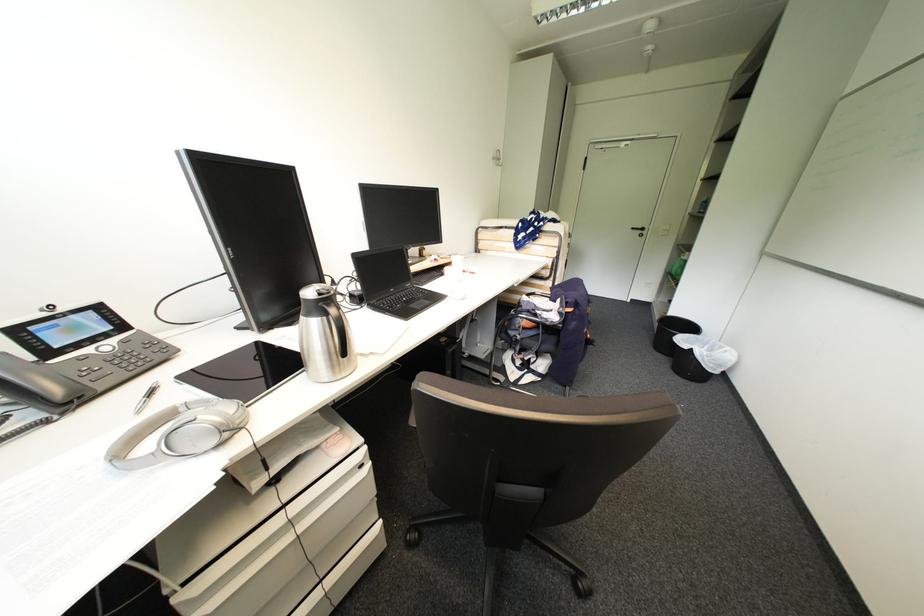
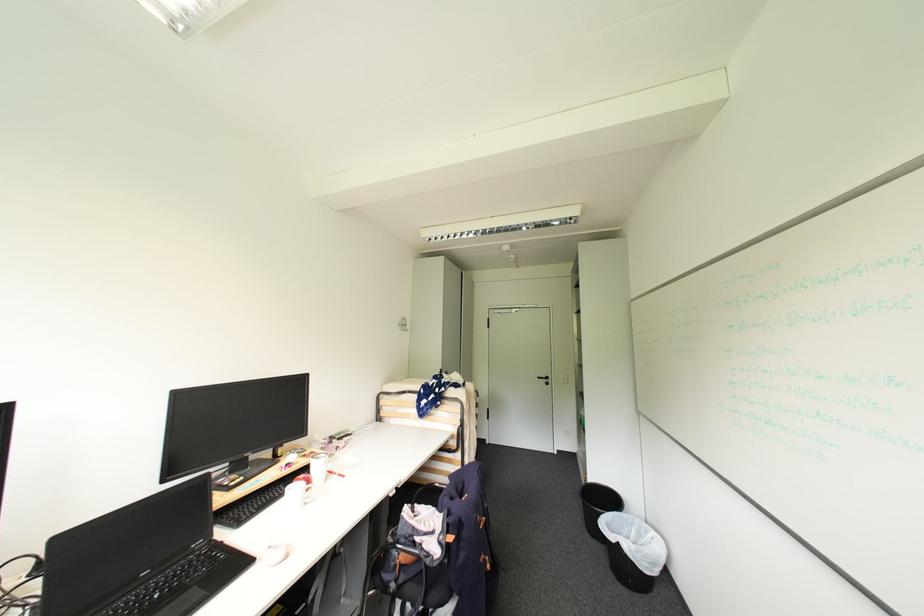
Find the pixel in the second image that matches (447,259) in the first image.

(311, 456)